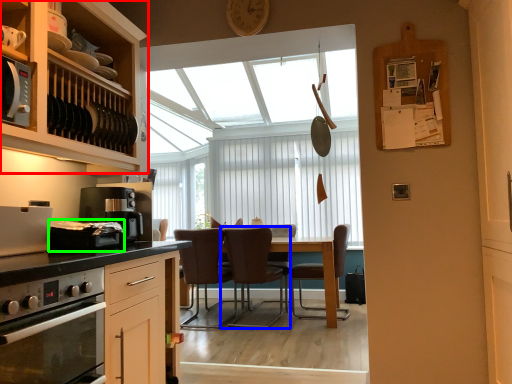
Question: Estimate the real-world distances between objects in this image. Which object is closer to cabinetry (highlighted by a red box), chair (highlighted by a blue box) or appliance (highlighted by a green box)?

Choices:
 (A) chair
 (B) appliance

Answer: (B)